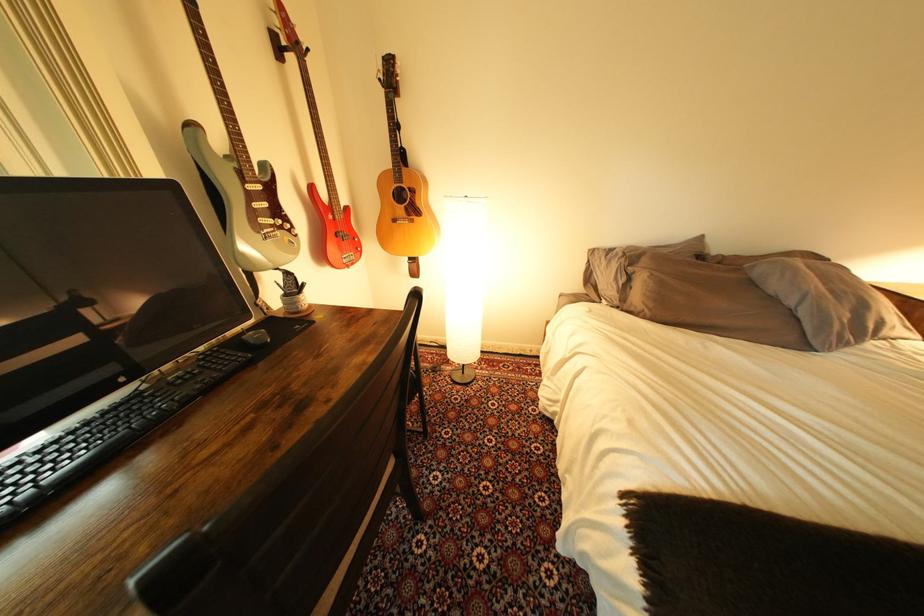
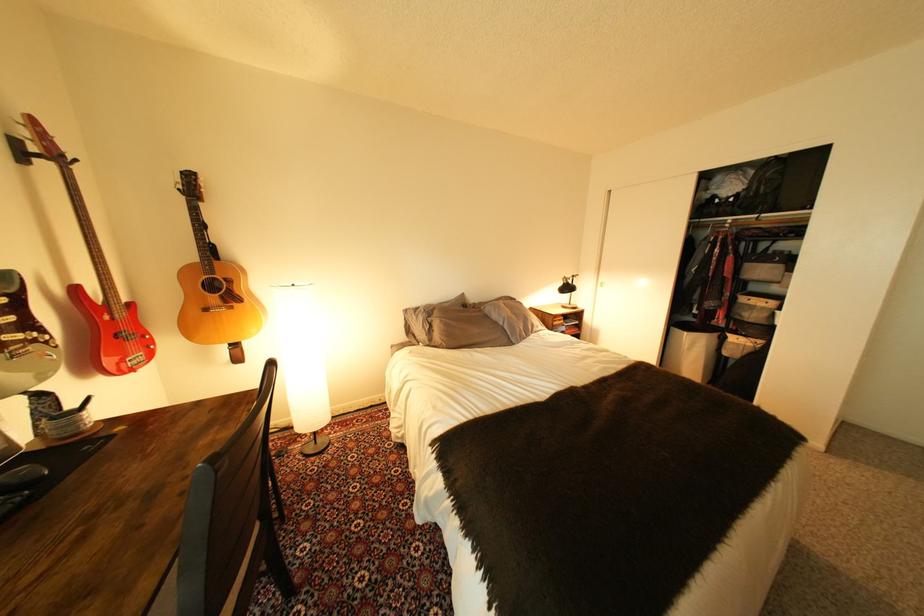
Question: The camera is either moving clockwise (left) or counter-clockwise (right) around the object. The first image is from the beginning of the video and the second image is from the end. Is the camera moving left or right when shooting the video?

Choices:
 (A) Left
 (B) Right

Answer: (A)